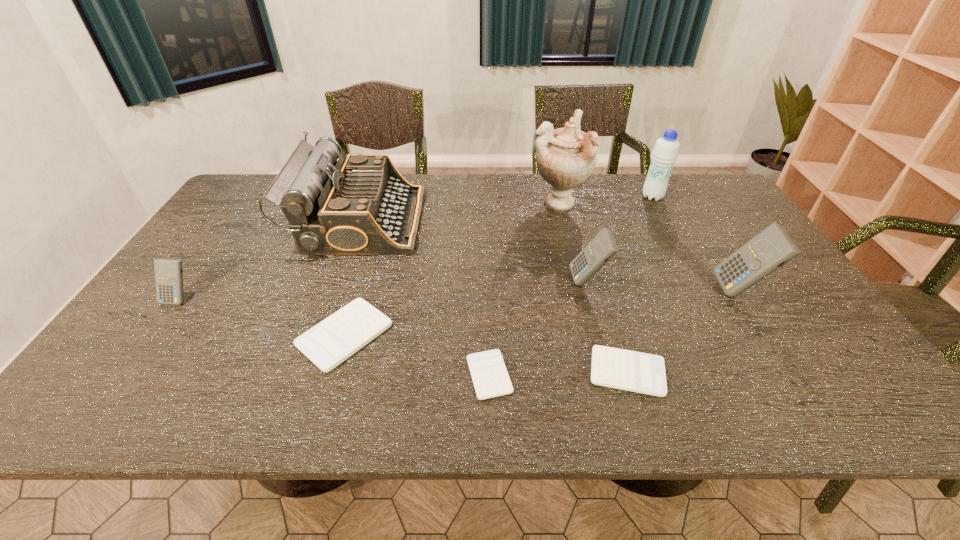
At what (x,y) coordinates should I click in order to perform the action: click on free space between the blue water bottle and the urn. Please return your answer as a coordinate pair (x, y). The image size is (960, 540). Looking at the image, I should click on (606, 200).

This screenshot has height=540, width=960. I want to click on empty location between the shortest object and the urn, so click(x=524, y=288).

You are a GUI agent. You are given a task and a screenshot of the screen. Output one action in this format:
    pyautogui.click(x=<x>, y=<y>)
    Task: Click on the vacant space that's between the second shortest object and the smallest white calculator
    
    Given the screenshot: What is the action you would take?
    pyautogui.click(x=559, y=373)

This screenshot has width=960, height=540. What are the coordinates of `vacant space that is in between the tallest object and the second smallest white calculator` in the screenshot? It's located at (592, 287).

This screenshot has width=960, height=540. In order to click on free area in between the typewriter and the water bottle in this screenshot , I will do `click(506, 208)`.

In order to click on blank region between the tallest object and the second calculator from left to right in this screenshot , I will do `click(451, 268)`.

In order to click on free space between the urn and the eighth tallest object in this screenshot , I will do `click(592, 287)`.

Select which object appears as the second closest to the typewriter. Please provide its 2D coordinates. Your answer should be formatted as a tuple, i.e. [(x, y)], where the tuple contains the x and y coordinates of a point satisfying the conditions above.

[(168, 272)]

The width and height of the screenshot is (960, 540). In order to click on the fifth closest object relative to the typewriter in this screenshot , I will do `click(603, 247)`.

Locate which calculator ranks sixth in proximity to the tallest object. Please provide its 2D coordinates. Your answer should be formatted as a tuple, i.e. [(x, y)], where the tuple contains the x and y coordinates of a point satisfying the conditions above.

[(168, 272)]